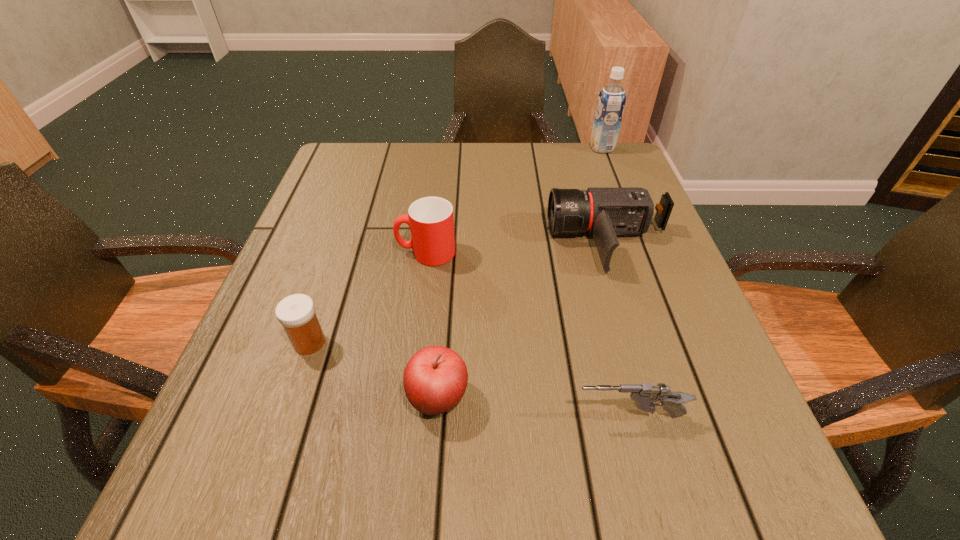
The width and height of the screenshot is (960, 540). In order to click on blank space located 0.340m at the barrel of the gun in this screenshot , I will do `click(350, 416)`.

Where is `object that is at the far edge`? The width and height of the screenshot is (960, 540). object that is at the far edge is located at coordinates (x=611, y=102).

You are a GUI agent. You are given a task and a screenshot of the screen. Output one action in this format:
    pyautogui.click(x=<x>, y=<y>)
    Task: Click on the object positioned at the left edge
    This screenshot has width=960, height=540.
    Given the screenshot: What is the action you would take?
    pyautogui.click(x=296, y=312)

Where is `soya milk present at the right edge`? soya milk present at the right edge is located at coordinates (611, 102).

Find the location of a particular element. This screenshot has height=540, width=960. camcorder that is positioned at the right edge is located at coordinates 602,212.

Where is `gun that is positioned at the right edge`? Image resolution: width=960 pixels, height=540 pixels. gun that is positioned at the right edge is located at coordinates (644, 394).

What are the coordinates of `object located in the far right corner section of the desktop` in the screenshot? It's located at (611, 102).

In the image, there is a desktop. At what (x,y) coordinates should I click in order to perform the action: click on free space at the far edge. Please return your answer as a coordinate pair (x, y). Looking at the image, I should click on (404, 154).

Identify the location of vacant space at the near edge. pyautogui.click(x=414, y=482).

Where is `vacant space at the left edge of the desktop`? The image size is (960, 540). vacant space at the left edge of the desktop is located at coordinates (294, 247).